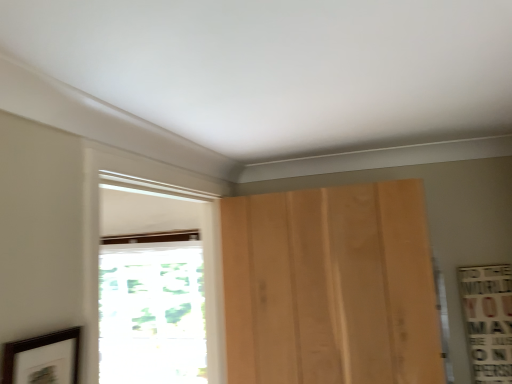
Question: Is white wood window at center, placed as the 2th window when sorted from back to front, taller or shorter than dark brown wooden picture frame at lower left?

Choices:
 (A) short
 (B) tall

Answer: (B)

Question: Is white wood window at center, placed as the 2th window when sorted from back to front, to the left or to the right of dark brown wooden picture frame at lower left in the image?

Choices:
 (A) right
 (B) left

Answer: (A)

Question: Which object is the closest to the light brown wood door at center?

Choices:
 (A) white wood window at center, the first window from the front
 (B) dark brown wooden picture frame at lower left
 (C) transparent glass window at left, which is counted as the 1th window, starting from the back

Answer: (A)

Question: Estimate the real-world distances between objects in this image. Which object is farther from the white wood window at center, the first window from the front?

Choices:
 (A) transparent glass window at left, which is counted as the 1th window, starting from the back
 (B) dark brown wooden picture frame at lower left
 (C) light brown wood door at center

Answer: (A)